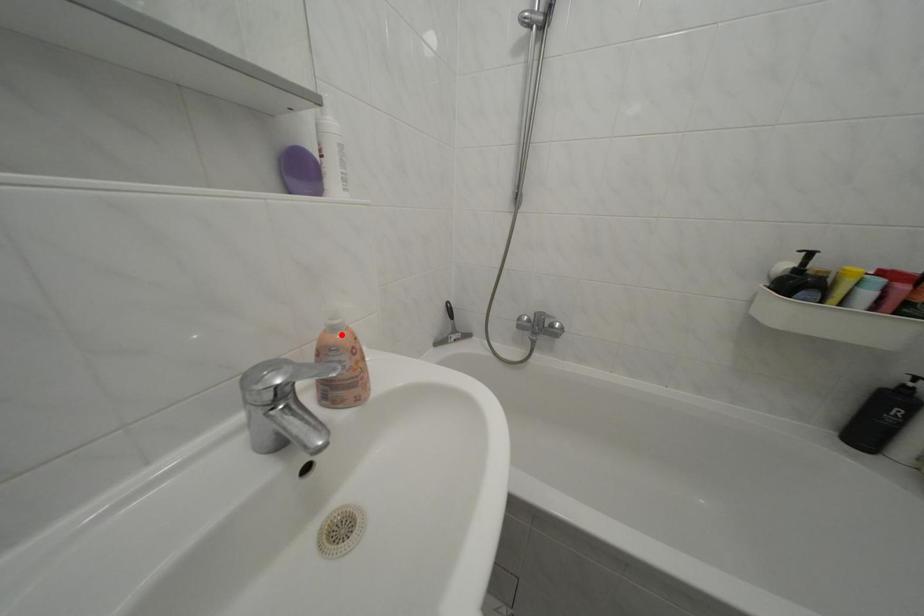
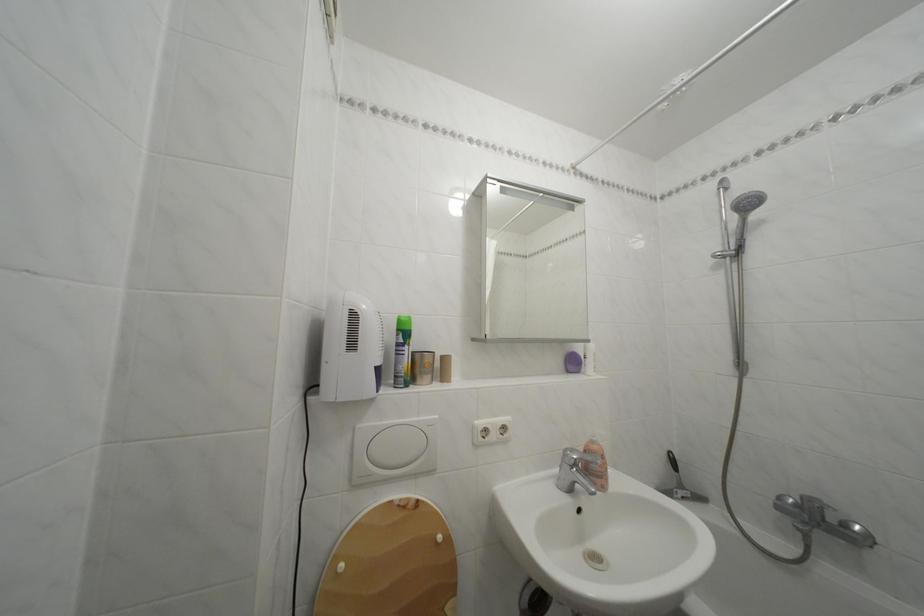
Where in the second image is the point corresponding to the highlighted location from the first image?

(602, 448)